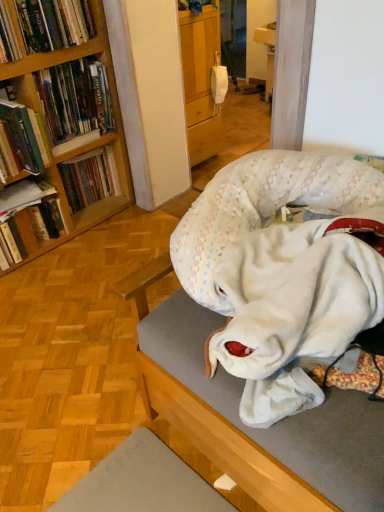
What is the approximate height of hardcover book at upper left, acting as the 6th book starting from the bottom?

hardcover book at upper left, acting as the 6th book starting from the bottom, is 7.66 inches in height.

Describe the element at coordinates (43, 26) in the screenshot. The height and width of the screenshot is (512, 384). I see `hardcover book at upper left, placed as the 1th book when sorted from top to bottom` at that location.

You are a GUI agent. You are given a task and a screenshot of the screen. Output one action in this format:
    pyautogui.click(x=<x>, y=<y>)
    Task: Click on the hardcover book at left, which is the 2th book in bottom-to-top order
    The image size is (384, 512).
    Given the screenshot: What is the action you would take?
    pyautogui.click(x=23, y=196)

This screenshot has height=512, width=384. I want to click on hardcover books at left, the second book when ordered from top to bottom, so click(75, 99).

Identify the location of hardcover book at left, which ranks as the 1th book in bottom-to-top order. Image resolution: width=384 pixels, height=512 pixels. (30, 230).

At what (x,y) coordinates should I click in order to perform the action: click on hardcover book at left, which is counted as the third book, starting from the bottom. Please return your answer as a coordinate pair (x, y). The image size is (384, 512). Looking at the image, I should click on (89, 178).

Find the location of a particular element. hardcover book at upper left, placed as the 1th book when sorted from top to bottom is located at coordinates coord(43,26).

From a real-world perspective, who is located higher, hardcover book at left, which ranks as the 1th book in bottom-to-top order, or hardcover book at upper left, placed as the 1th book when sorted from top to bottom?

hardcover book at upper left, placed as the 1th book when sorted from top to bottom, is physically above.

Which is behind, hardcover book at left, the 6th book positioned from the top, or hardcover book at upper left, acting as the 6th book starting from the bottom?

hardcover book at left, the 6th book positioned from the top, is behind.

Which is in front, point (60, 214) or point (35, 14)?

The point (35, 14) is closer.

Considering the sizes of hardcover book at left, which ranks as the 1th book in bottom-to-top order, and hardcover book at upper left, placed as the 1th book when sorted from top to bottom, in the image, is hardcover book at left, which ranks as the 1th book in bottom-to-top order, wider or thinner than hardcover book at upper left, placed as the 1th book when sorted from top to bottom,?

Clearly, hardcover book at left, which ranks as the 1th book in bottom-to-top order, has less width compared to hardcover book at upper left, placed as the 1th book when sorted from top to bottom.

Would you consider white plush dog bed at center to be distant from hardcover book at upper left, acting as the 6th book starting from the bottom?

Yes.

Is white plush dog bed at center looking in the opposite direction of hardcover book at upper left, placed as the 1th book when sorted from top to bottom?

No, hardcover book at upper left, placed as the 1th book when sorted from top to bottom, is not at the back of white plush dog bed at center.

Considering the relative positions of white plush dog bed at center and hardcover book at upper left, placed as the 1th book when sorted from top to bottom, in the image provided, is white plush dog bed at center in front of hardcover book at upper left, placed as the 1th book when sorted from top to bottom,?

Yes, white plush dog bed at center is in front of hardcover book at upper left, placed as the 1th book when sorted from top to bottom.

Which point is more distant from viewer, (246,368) or (42,19)?

The point (42,19) is farther.

From the image's perspective, who appears lower, hardcover book at upper left, acting as the 6th book starting from the bottom, or hardcover books at left, the second book when ordered from top to bottom?

From the image's view, hardcover books at left, the second book when ordered from top to bottom, is below.

Could you tell me if hardcover book at upper left, acting as the 6th book starting from the bottom, is turned towards hardcover books at left, the second book when ordered from top to bottom?

No, hardcover book at upper left, acting as the 6th book starting from the bottom, is not turned towards hardcover books at left, the second book when ordered from top to bottom.

Is hardcover book at upper left, placed as the 1th book when sorted from top to bottom, outside of hardcover books at left, the second book when ordered from top to bottom?

Yes, hardcover book at upper left, placed as the 1th book when sorted from top to bottom, is outside of hardcover books at left, the second book when ordered from top to bottom.

From a real-world perspective, between hardcover book at upper left, placed as the 1th book when sorted from top to bottom, and hardcover books at left, acting as the fifth book starting from the bottom, who is vertically lower?

In real-world perspective, hardcover books at left, acting as the fifth book starting from the bottom, is lower.

Is white plush dog bed at center smaller than hardcover book at left, the fourth book in the top-to-bottom sequence?

No.

In the scene shown: Do you think white plush dog bed at center is within hardcover book at left, the fourth book in the top-to-bottom sequence, or outside of it?

white plush dog bed at center is located beyond the bounds of hardcover book at left, the fourth book in the top-to-bottom sequence.

Is there a large distance between white plush dog bed at center and hardcover book at left, the fourth book in the top-to-bottom sequence?

Yes, white plush dog bed at center and hardcover book at left, the fourth book in the top-to-bottom sequence, are quite far apart.

In terms of width, does white plush dog bed at center look wider or thinner when compared to hardcover book at left, the fourth book in the top-to-bottom sequence?

white plush dog bed at center is wider than hardcover book at left, the fourth book in the top-to-bottom sequence.

Find the location of a particular element. dog bed that appears below the hardcover book at left, which is counted as the third book, starting from the top (from a real-world perspective) is located at coordinates (272, 329).

How far apart are white plush dog bed at center and hardcover book at left, which is counted as the third book, starting from the top?

white plush dog bed at center and hardcover book at left, which is counted as the third book, starting from the top, are 1.17 meters apart.

How different are the orientations of white plush dog bed at center and hardcover book at left, which is counted as the 4th book, starting from the bottom, in degrees?

The angular difference between white plush dog bed at center and hardcover book at left, which is counted as the 4th book, starting from the bottom, is 91.8 degrees.

From the image's perspective, who appears lower, white plush dog bed at center or hardcover book at left, which is counted as the 4th book, starting from the bottom?

white plush dog bed at center.

Can you tell me how much hardcover book at left, the fifth book when ordered from top to bottom, and hardcover book at left, which is counted as the third book, starting from the top, differ in facing direction?

They differ by 0.000109 degrees in their facing directions.

Is point (14, 200) positioned after point (23, 135)?

Yes, it is.

Does hardcover book at left, the fifth book when ordered from top to bottom, have a greater height compared to hardcover book at left, which is counted as the 4th book, starting from the bottom?

No, hardcover book at left, the fifth book when ordered from top to bottom, is not taller than hardcover book at left, which is counted as the 4th book, starting from the bottom.

Can you confirm if hardcover book at left, which is the 2th book in bottom-to-top order, is smaller than hardcover book at left, which is counted as the third book, starting from the top?

Yes.

Is hardcover book at upper left, acting as the 6th book starting from the bottom, aimed at hardcover book at left, which is counted as the 4th book, starting from the bottom?

No.

From the image's perspective, starting from the hardcover book at left, which is counted as the third book, starting from the top, which book is the 2nd one above? Please provide its 2D coordinates.

[(43, 26)]

From a real-world perspective, is hardcover book at upper left, acting as the 6th book starting from the bottom, located higher than hardcover book at left, which is counted as the third book, starting from the top?

Yes, from a real-world perspective, hardcover book at upper left, acting as the 6th book starting from the bottom, is on top of hardcover book at left, which is counted as the third book, starting from the top.

Looking at this image, which is in front, hardcover book at upper left, acting as the 6th book starting from the bottom, or hardcover book at left, which is counted as the third book, starting from the top?

hardcover book at left, which is counted as the third book, starting from the top, is in front.

The height and width of the screenshot is (512, 384). In order to click on the 2nd book behind the hardcover book at upper left, placed as the 1th book when sorted from top to bottom, counting from the anchor's position in this screenshot , I will do `click(30, 230)`.

The width and height of the screenshot is (384, 512). In the image, there is a hardcover book at upper left, placed as the 1th book when sorted from top to bottom. Identify the location of dog bed below it (from the image's perspective). (272, 329).

Which object lies further to the anchor point hardcover book at left, the fourth book in the top-to-bottom sequence, hardcover book at left, the fifth book when ordered from top to bottom, or white plush dog bed at center?

white plush dog bed at center is further to hardcover book at left, the fourth book in the top-to-bottom sequence.

Estimate the real-world distances between objects in this image. Which object is closer to hardcover book at left, which is the 2th book in bottom-to-top order, hardcover book at left, which is counted as the third book, starting from the top, or white plush dog bed at center?

hardcover book at left, which is counted as the third book, starting from the top, is positioned closer to the anchor hardcover book at left, which is the 2th book in bottom-to-top order.

Considering their positions, is hardcover book at left, which is counted as the 4th book, starting from the bottom, positioned closer to hardcover book at left, which is counted as the third book, starting from the bottom, than hardcover books at left, the second book when ordered from top to bottom?

hardcover books at left, the second book when ordered from top to bottom, is positioned closer to the anchor hardcover book at left, which is counted as the third book, starting from the bottom.

Considering their positions, is hardcover book at left, which is the 2th book in bottom-to-top order, positioned closer to hardcover book at upper left, placed as the 1th book when sorted from top to bottom, than hardcover books at left, acting as the fifth book starting from the bottom?

Among the two, hardcover books at left, acting as the fifth book starting from the bottom, is located nearer to hardcover book at upper left, placed as the 1th book when sorted from top to bottom.

When comparing their distances from hardcover book at left, which is counted as the third book, starting from the bottom, does white plush dog bed at center or hardcover book at left, which ranks as the 1th book in bottom-to-top order, seem closer?

hardcover book at left, which ranks as the 1th book in bottom-to-top order, is positioned closer to the anchor hardcover book at left, which is counted as the third book, starting from the bottom.

Looking at the image, which one is located closer to hardcover book at left, which is counted as the third book, starting from the top, hardcover book at upper left, acting as the 6th book starting from the bottom, or hardcover books at left, acting as the fifth book starting from the bottom?

hardcover books at left, acting as the fifth book starting from the bottom, is positioned closer to the anchor hardcover book at left, which is counted as the third book, starting from the top.

Which object lies nearer to the anchor point hardcover book at upper left, acting as the 6th book starting from the bottom, hardcover book at left, which is the 2th book in bottom-to-top order, or hardcover book at left, which is counted as the third book, starting from the top?

Among the two, hardcover book at left, which is counted as the third book, starting from the top, is located nearer to hardcover book at upper left, acting as the 6th book starting from the bottom.

When comparing their distances from hardcover book at left, the fifth book when ordered from top to bottom, does hardcover book at left, which ranks as the 1th book in bottom-to-top order, or hardcover book at left, which is counted as the third book, starting from the top, seem further?

Among the two, hardcover book at left, which is counted as the third book, starting from the top, is located further to hardcover book at left, the fifth book when ordered from top to bottom.

You are a GUI agent. You are given a task and a screenshot of the screen. Output one action in this format:
    pyautogui.click(x=<x>, y=<y>)
    Task: Click on the book between hardcover book at upper left, acting as the 6th book starting from the bottom, and hardcover book at left, which is counted as the third book, starting from the top, from top to bottom
    
    Given the screenshot: What is the action you would take?
    pyautogui.click(x=75, y=99)

Where is `book positioned between hardcover book at left, the 6th book positioned from the top, and hardcover book at left, which is counted as the third book, starting from the bottom, from near to far`? book positioned between hardcover book at left, the 6th book positioned from the top, and hardcover book at left, which is counted as the third book, starting from the bottom, from near to far is located at coordinates (23, 196).